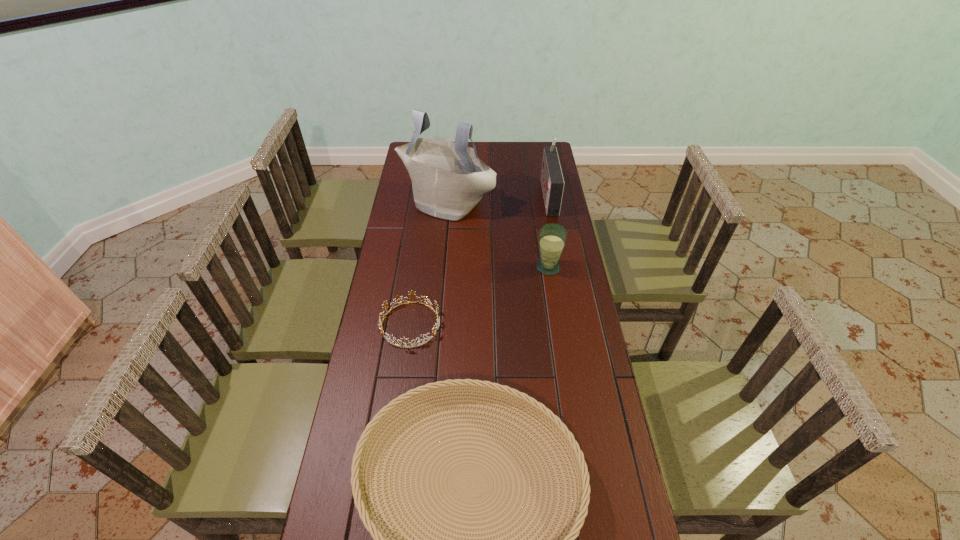
This screenshot has height=540, width=960. Identify the location of vacant area situated 0.330m on the front of the third nearest object. (562, 352).

The height and width of the screenshot is (540, 960). Find the location of `vacant point located on the front-facing side of the second nearest object`. vacant point located on the front-facing side of the second nearest object is located at coordinates coord(393,454).

At what (x,y) coordinates should I click in order to perform the action: click on shopping bag present at the left edge. Please return your answer as a coordinate pair (x, y). Looking at the image, I should click on (448, 179).

What are the coordinates of `tiara located in the left edge section of the desktop` in the screenshot? It's located at (412, 293).

Identify the location of radio receiver that is at the right edge. (552, 181).

Where is `glass present at the right edge`? This screenshot has height=540, width=960. glass present at the right edge is located at coordinates 552,238.

Where is `vacant space at the left edge of the desktop`? Image resolution: width=960 pixels, height=540 pixels. vacant space at the left edge of the desktop is located at coordinates (377, 399).

Image resolution: width=960 pixels, height=540 pixels. Find the location of `free region at the right edge of the desktop`. free region at the right edge of the desktop is located at coordinates (576, 315).

I want to click on vacant area at the far right corner, so click(x=541, y=146).

Where is `vacant region between the glass and the second nearest object`? This screenshot has width=960, height=540. vacant region between the glass and the second nearest object is located at coordinates (479, 296).